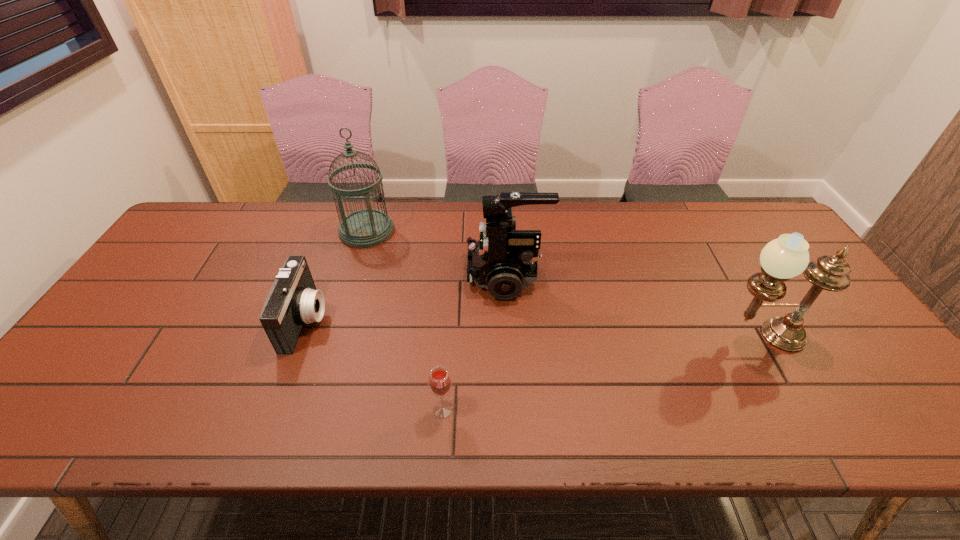
Find the location of a particular element. This screenshot has width=960, height=540. blank space located 0.350m on the lens mount of the third shortest object is located at coordinates (346, 276).

I want to click on free spot located 0.380m on the lens mount of the third shortest object, so click(335, 276).

This screenshot has height=540, width=960. Find the location of `free region located 0.090m on the lens of the shorter camcorder`. free region located 0.090m on the lens of the shorter camcorder is located at coordinates (359, 320).

Where is `vacant space positioned 0.350m on the left of the third object from left to right`? The image size is (960, 540). vacant space positioned 0.350m on the left of the third object from left to right is located at coordinates (273, 409).

This screenshot has width=960, height=540. Identify the location of object that is at the far edge. (364, 228).

At what (x,y) coordinates should I click in order to perform the action: click on object at the near edge. Please return your answer as a coordinate pair (x, y). The image size is (960, 540). Looking at the image, I should click on (440, 382).

You are a GUI agent. You are given a task and a screenshot of the screen. Output one action in this format:
    pyautogui.click(x=<x>, y=<y>)
    Task: Click on the object at the right edge
    This screenshot has width=960, height=540.
    Given the screenshot: What is the action you would take?
    pyautogui.click(x=787, y=256)

Where is `free region at the far edge of the desktop`? This screenshot has height=540, width=960. free region at the far edge of the desktop is located at coordinates (612, 226).

The image size is (960, 540). Identify the location of vacant space at the near edge of the desktop. (266, 434).

I want to click on vacant space at the right edge of the desktop, so click(x=852, y=354).